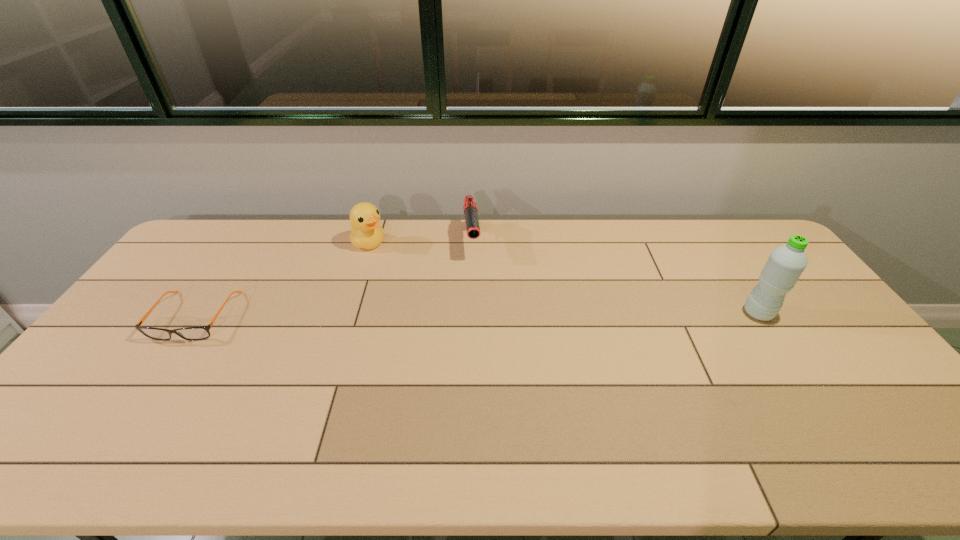
In order to click on blank region between the gun and the second object from left to right in this screenshot , I will do `click(420, 242)`.

Image resolution: width=960 pixels, height=540 pixels. In order to click on free spot between the gun and the leftmost object in this screenshot , I will do `click(334, 279)`.

Where is `unoccupied position between the duck and the third object from left to right`? The height and width of the screenshot is (540, 960). unoccupied position between the duck and the third object from left to right is located at coordinates (420, 242).

Find the location of a particular element. vacant space in between the third object from left to right and the leftmost object is located at coordinates (334, 279).

Find the location of a particular element. The height and width of the screenshot is (540, 960). vacant space in between the tallest object and the shortest object is located at coordinates (476, 315).

Where is `empty location between the second object from right to left and the third object from right to left`? The height and width of the screenshot is (540, 960). empty location between the second object from right to left and the third object from right to left is located at coordinates (420, 242).

The height and width of the screenshot is (540, 960). Find the location of `free area in between the spectacles and the rightmost object`. free area in between the spectacles and the rightmost object is located at coordinates (476, 315).

Find the location of a particular element. unoccupied position between the leftmost object and the third object from left to right is located at coordinates (334, 279).

Identify the location of free point between the third object from left to right and the tallest object. (615, 278).

The width and height of the screenshot is (960, 540). Find the location of `free space between the gun and the tallest object`. free space between the gun and the tallest object is located at coordinates (615, 278).